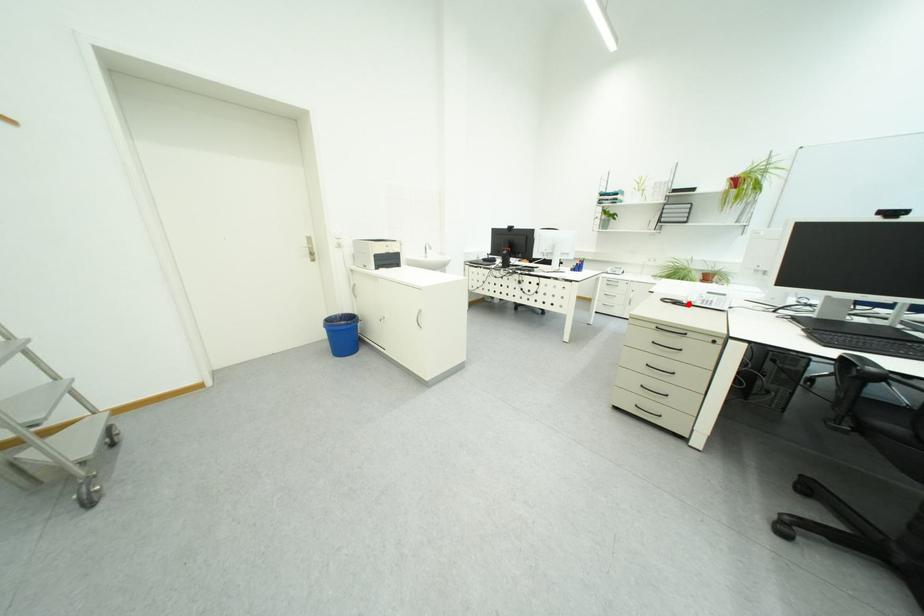
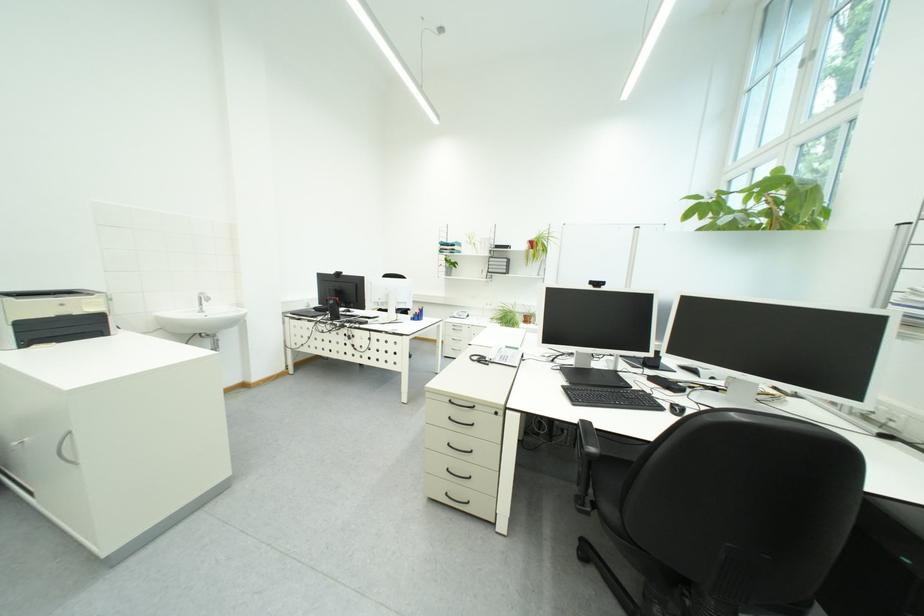
Find the pixel in the second image that matches the highlighted location in the first image.

(492, 362)